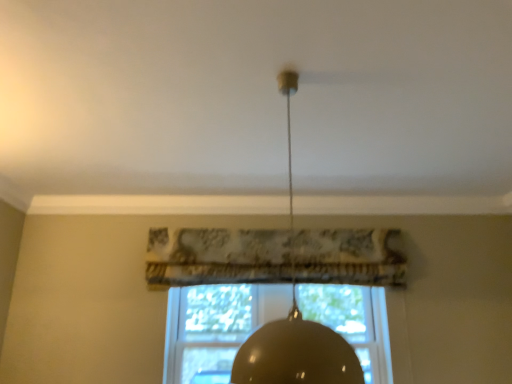
What do you see at coordinates (295, 325) in the screenshot? I see `matte black lampshade at center` at bounding box center [295, 325].

This screenshot has width=512, height=384. I want to click on matte black lampshade at center, so click(x=295, y=325).

Locate an element on the screen. matte black lampshade at center is located at coordinates (295, 325).